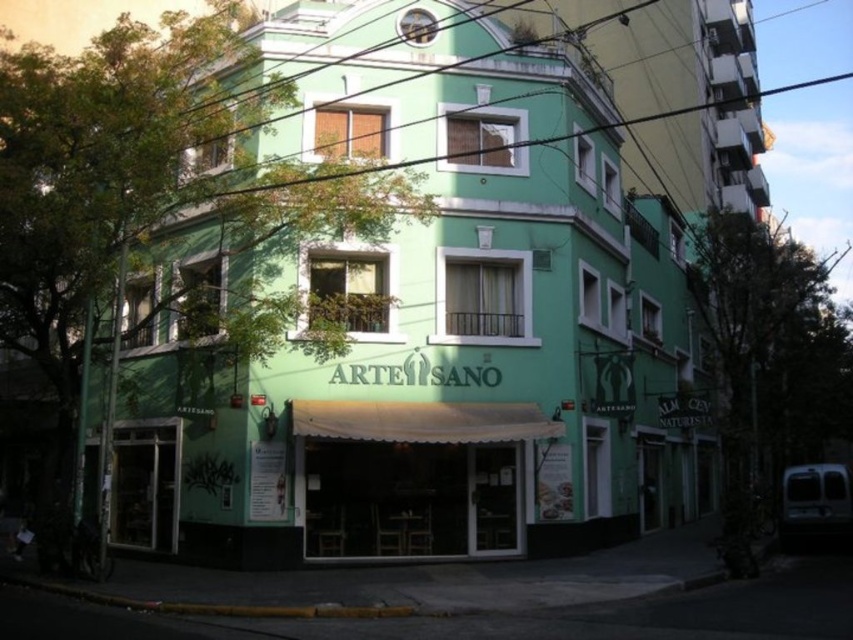
You are standing on the sidewalk in front of the green matte building at center and the white fabric awning at center. Which object is closer to the left side of the street?

The white fabric awning at center is closer to the left side of the street because the green matte building at center is to the right of it.

You are a delivery person standing at the entrance of the green matte building at center. You need to place a package on the white fabric awning at center. Can you reach it without moving more than 8 meters?

The green matte building at center is 7.99 meters away from the white fabric awning at center, so yes, you can reach it without moving more than 8 meters since the distance is just under the limit.

You are a delivery person trying to deliver a package to the ARTE SANO building. The package is too big to fit through the entrance. Can you determine if the green matte building at center has a larger structure than the white fabric awning at center to accommodate the package?

The green matte building at center is larger in size than the white fabric awning at center, so the building itself has a bigger structure and should be able to accommodate the large package.